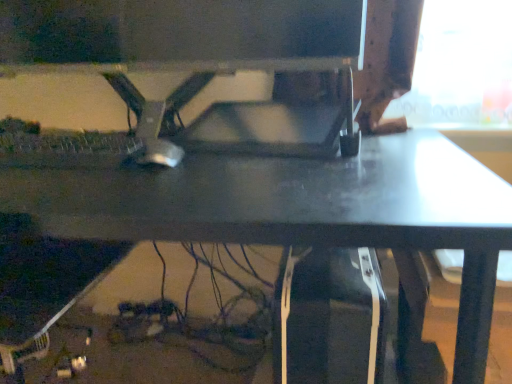
Question: Can you confirm if matte black monitor at center is shorter than silver metallic mouse at center?

Choices:
 (A) yes
 (B) no

Answer: (B)

Question: From the image's perspective, does matte black monitor at center appear lower than silver metallic mouse at center?

Choices:
 (A) yes
 (B) no

Answer: (B)

Question: Can you confirm if matte black monitor at center is taller than silver metallic mouse at center?

Choices:
 (A) yes
 (B) no

Answer: (A)

Question: Would you consider matte black monitor at center to be distant from silver metallic mouse at center?

Choices:
 (A) yes
 (B) no

Answer: (B)

Question: Is matte black monitor at center at the right side of silver metallic mouse at center?

Choices:
 (A) no
 (B) yes

Answer: (B)

Question: Can we say matte black monitor at center lies outside silver metallic mouse at center?

Choices:
 (A) yes
 (B) no

Answer: (A)

Question: Is matte black desk at center bigger than silver metallic mouse at center?

Choices:
 (A) no
 (B) yes

Answer: (B)

Question: Can you confirm if matte black desk at center is shorter than silver metallic mouse at center?

Choices:
 (A) no
 (B) yes

Answer: (A)

Question: From a real-world perspective, is matte black desk at center under silver metallic mouse at center?

Choices:
 (A) no
 (B) yes

Answer: (B)

Question: Can you confirm if matte black desk at center is smaller than silver metallic mouse at center?

Choices:
 (A) yes
 (B) no

Answer: (B)

Question: Is matte black desk at center to the right of silver metallic mouse at center from the viewer's perspective?

Choices:
 (A) no
 (B) yes

Answer: (A)

Question: Would you say matte black desk at center is a long distance from silver metallic mouse at center?

Choices:
 (A) no
 (B) yes

Answer: (A)

Question: Is matte black monitor at center located outside matte black desk at center?

Choices:
 (A) no
 (B) yes

Answer: (B)